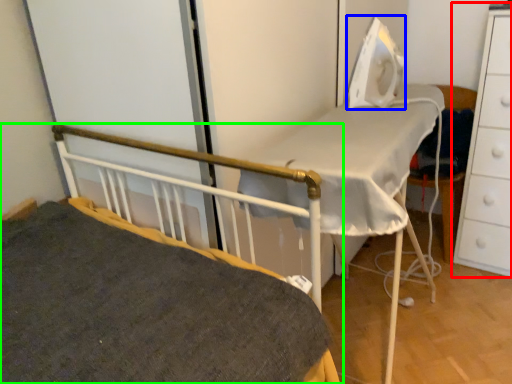
Question: Which object is the closest to the chest of drawers (highlighted by a red box)? Choose among these: equipment (highlighted by a blue box) or bed (highlighted by a green box).

Choices:
 (A) equipment
 (B) bed

Answer: (A)